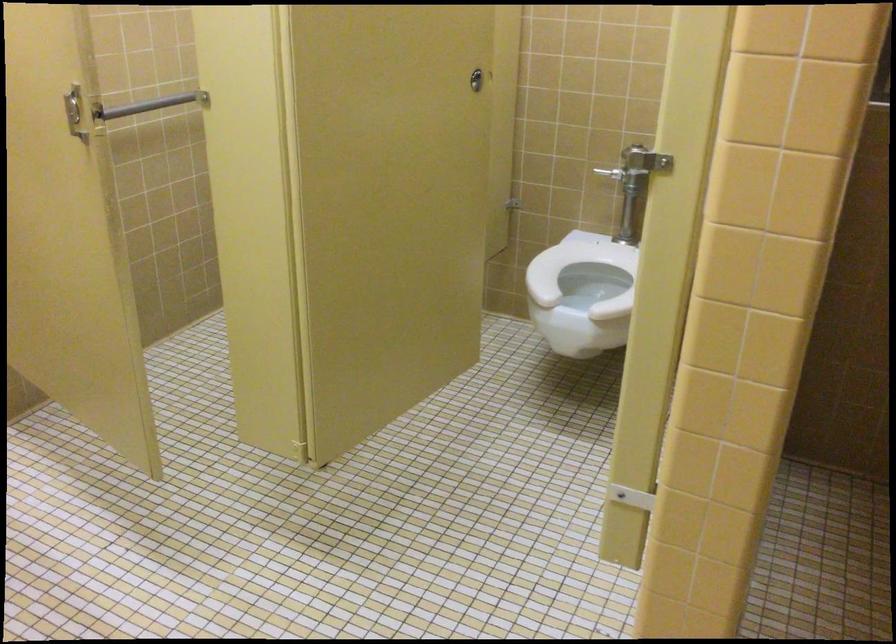
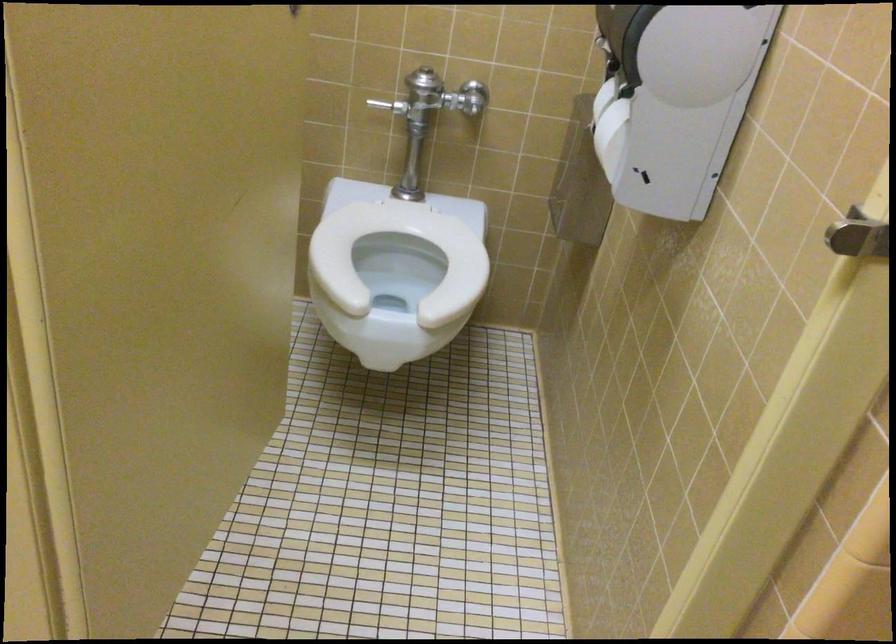
Which direction would the cameraman need to move to produce the second image?

The cameraman moved toward left, forward.